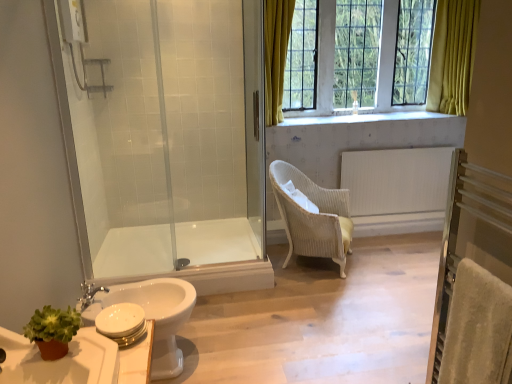
The width and height of the screenshot is (512, 384). I want to click on vacant space underneath white textured radiator at center right (from a real-world perspective), so click(403, 212).